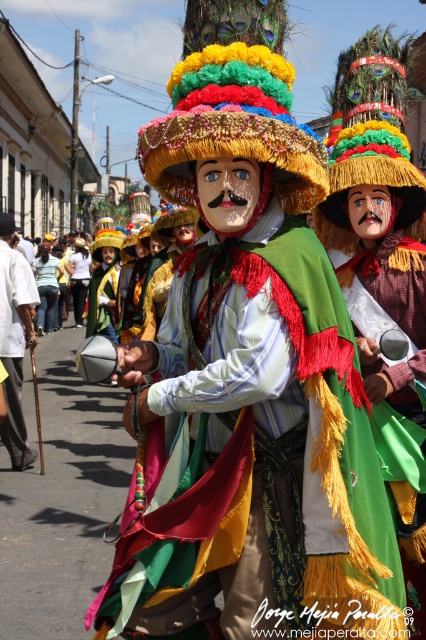
Question: Is multicolored fabric costume at center to the right of white cotton shirt at left from the viewer's perspective?

Choices:
 (A) yes
 (B) no

Answer: (A)

Question: Does multicolored fabric costume at center have a smaller size compared to white cotton shirt at left?

Choices:
 (A) yes
 (B) no

Answer: (A)

Question: Which object is closer to the camera taking this photo?

Choices:
 (A) white cotton shirt at left
 (B) multicolored fabric costume at center

Answer: (B)

Question: Can you confirm if multicolored fabric costume at center is bigger than white cotton shirt at left?

Choices:
 (A) no
 (B) yes

Answer: (A)

Question: Which point is farther to the camera?

Choices:
 (A) white cotton shirt at left
 (B) multicolored fabric costume at center

Answer: (A)